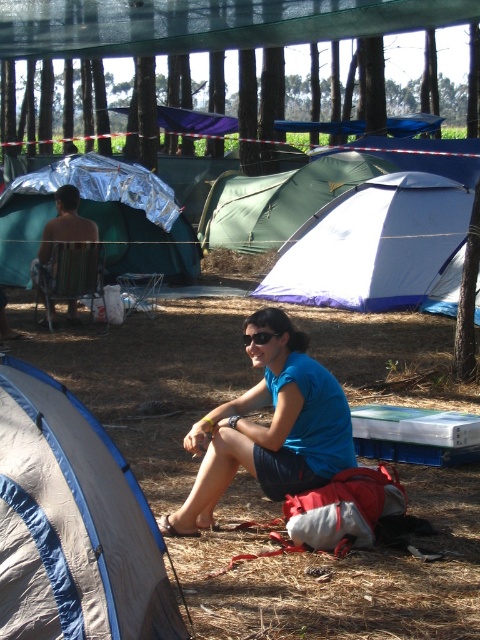
Question: Is blue fabric shorts at center closer to the viewer compared to black plastic goggles at center?

Choices:
 (A) yes
 (B) no

Answer: (A)

Question: In this image, where is blue fabric shorts at center located relative to black plastic goggles at center?

Choices:
 (A) below
 (B) above

Answer: (A)

Question: Which of the following is the farthest from the observer?

Choices:
 (A) shiny metallic chair at left
 (B) green fabric tent at center
 (C) gray fabric tent at lower left
 (D) white nylon tent at center

Answer: (B)

Question: Which of the following is the closest to the observer?

Choices:
 (A) shiny metallic chair at left
 (B) shiny metallic tent at center

Answer: (A)

Question: Which of the following is the farthest from the observer?

Choices:
 (A) white nylon tent at center
 (B) shiny metallic chair at left
 (C) green fabric tent at center
 (D) black plastic goggles at center

Answer: (C)

Question: Is white nylon tent at center to the left of shiny metallic tent at center from the viewer's perspective?

Choices:
 (A) no
 (B) yes

Answer: (A)